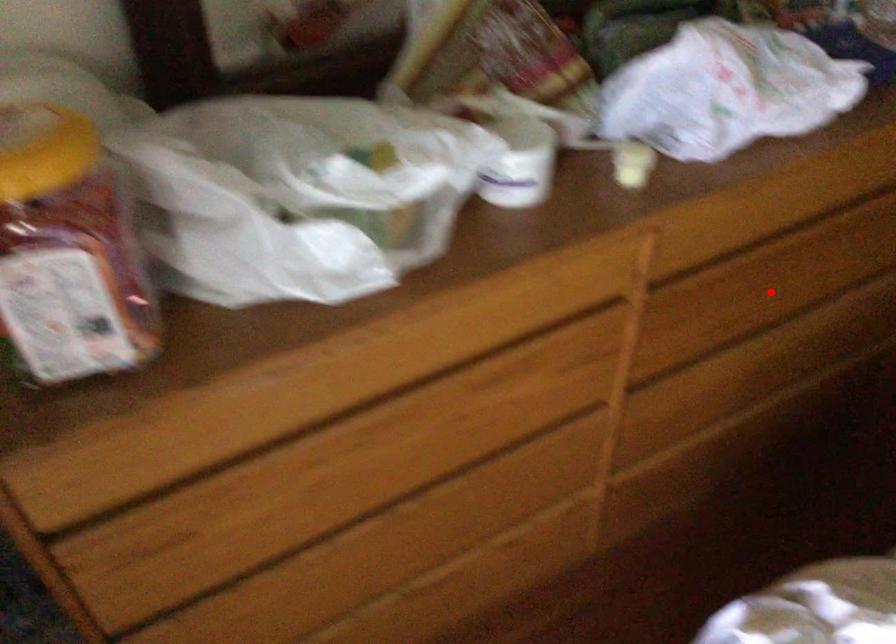
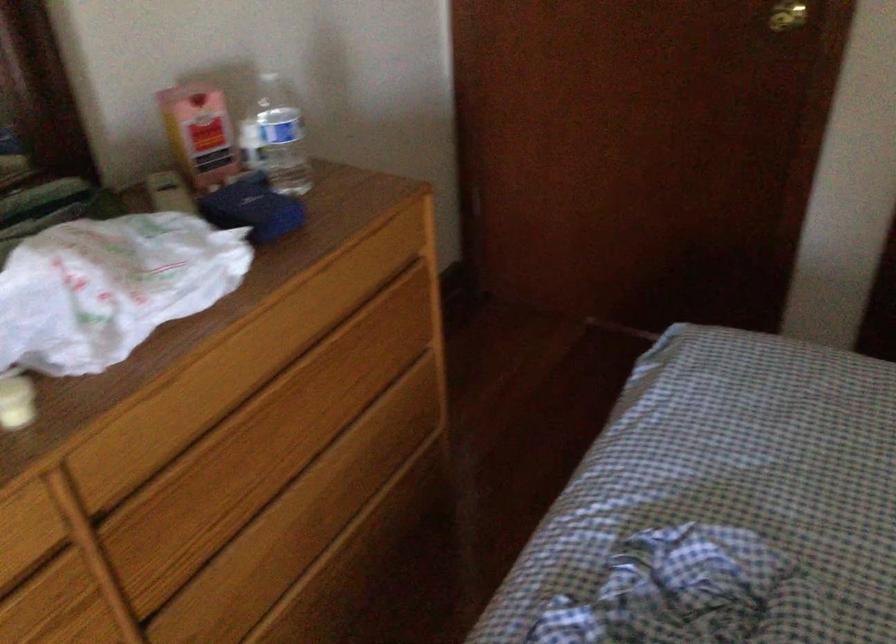
Question: I am providing you with two images of the same scene from different viewpoints. A red point is marked on the first image. Is the red point's position out of view in image 2?

Choices:
 (A) Yes
 (B) No

Answer: (B)